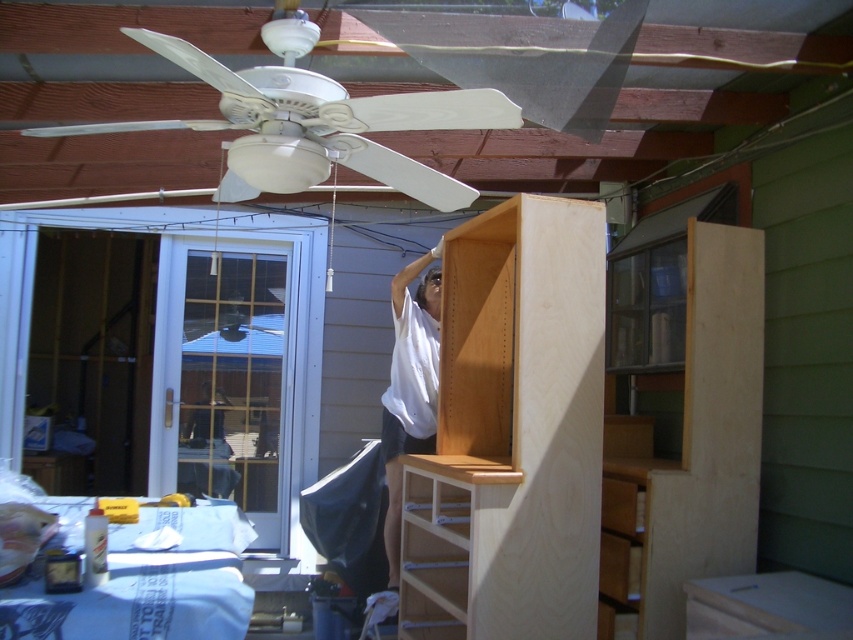
Does white matte ceiling fan at upper center have a larger size compared to white matte shirt at upper center?

Correct, white matte ceiling fan at upper center is larger in size than white matte shirt at upper center.

Can you confirm if white matte ceiling fan at upper center is positioned below white matte shirt at upper center?

No.

Between point (233, 200) and point (415, 353), which one is positioned in front?

Point (233, 200) is more forward.

Identify the location of white matte ceiling fan at upper center. (312, 120).